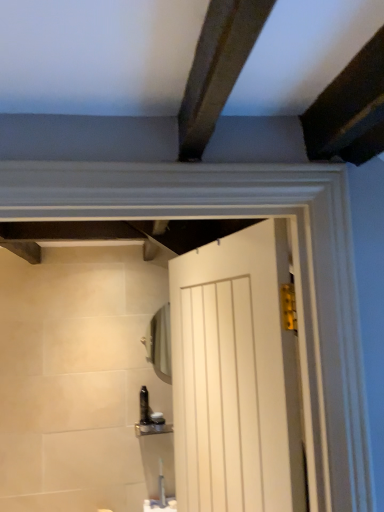
What are the coordinates of `white matte door at center` in the screenshot? It's located at (235, 376).

The image size is (384, 512). What do you see at coordinates (235, 376) in the screenshot? I see `white matte door at center` at bounding box center [235, 376].

Image resolution: width=384 pixels, height=512 pixels. Describe the element at coordinates (159, 343) in the screenshot. I see `clear glass mirror at upper center` at that location.

Where is `clear glass mirror at upper center`? clear glass mirror at upper center is located at coordinates (159, 343).

You are a GUI agent. You are given a task and a screenshot of the screen. Output one action in this format:
    pyautogui.click(x=<x>, y=<y>)
    Task: Click on the white matte door at center
    
    Given the screenshot: What is the action you would take?
    pyautogui.click(x=235, y=376)

Is white matte door at center at the right side of clear glass mirror at upper center?

Yes.

Which object is further away from the camera taking this photo, white matte door at center or clear glass mirror at upper center?

Positioned behind is clear glass mirror at upper center.

Is point (235, 311) farther from camera compared to point (147, 333)?

No, it is in front of (147, 333).

From the image's perspective, would you say white matte door at center is shown under clear glass mirror at upper center?

No, from the image's perspective, white matte door at center is not beneath clear glass mirror at upper center.

From a real-world perspective, between white matte door at center and clear glass mirror at upper center, who is vertically lower?

white matte door at center is physically lower.

Which of these two, white matte door at center or clear glass mirror at upper center, is wider?

Wider between the two is white matte door at center.

Is white matte door at center shorter than clear glass mirror at upper center?

No.

Looking at the image, does white matte door at center seem bigger or smaller compared to clear glass mirror at upper center?

Clearly, white matte door at center is larger in size than clear glass mirror at upper center.

Is clear glass mirror at upper center located within white matte door at center?

That's incorrect, clear glass mirror at upper center is not inside white matte door at center.

Is white matte door at center far away from clear glass mirror at upper center?

No, white matte door at center is not far away from clear glass mirror at upper center.

Is white matte door at center looking in the opposite direction of clear glass mirror at upper center?

No, white matte door at center's orientation is not away from clear glass mirror at upper center.

At what (x,y) coordinates should I click in order to perform the action: click on door above the clear glass mirror at upper center (from the image's perspective). Please return your answer as a coordinate pair (x, y). Image resolution: width=384 pixels, height=512 pixels. Looking at the image, I should click on (235, 376).

Is clear glass mirror at upper center to the left of white matte door at center from the viewer's perspective?

Yes.

Which object is more forward, clear glass mirror at upper center or white matte door at center?

white matte door at center is closer to the camera.

Which is more distant, (165, 373) or (230, 339)?

The point (165, 373) is more distant.

From the image's perspective, who appears lower, clear glass mirror at upper center or white matte door at center?

clear glass mirror at upper center is shown below in the image.

From a real-world perspective, is clear glass mirror at upper center over white matte door at center?

Indeed, from a real-world perspective, clear glass mirror at upper center stands above white matte door at center.

Does clear glass mirror at upper center have a greater width compared to white matte door at center?

No, clear glass mirror at upper center is not wider than white matte door at center.

Looking at this image, from their relative heights in the image, would you say clear glass mirror at upper center is taller or shorter than white matte door at center?

In the image, clear glass mirror at upper center appears to be shorter than white matte door at center.

From the picture: Considering the sizes of objects clear glass mirror at upper center and white matte door at center in the image provided, who is bigger, clear glass mirror at upper center or white matte door at center?

white matte door at center.

Is white matte door at center a part of clear glass mirror at upper center?

Actually, white matte door at center is outside clear glass mirror at upper center.

Are clear glass mirror at upper center and white matte door at center far apart?

No, there isn't a large distance between clear glass mirror at upper center and white matte door at center.

Is clear glass mirror at upper center facing away from white matte door at center?

No, clear glass mirror at upper center's orientation is not away from white matte door at center.

Can you tell me how much clear glass mirror at upper center and white matte door at center differ in facing direction?

The angular difference between clear glass mirror at upper center and white matte door at center is 78.8 degrees.

Identify the location of mirror below the white matte door at center (from the image's perspective). (159, 343).

The height and width of the screenshot is (512, 384). In order to click on door directly beneath the clear glass mirror at upper center (from a real-world perspective) in this screenshot , I will do `click(235, 376)`.

The image size is (384, 512). I want to click on door above the clear glass mirror at upper center (from the image's perspective), so click(x=235, y=376).